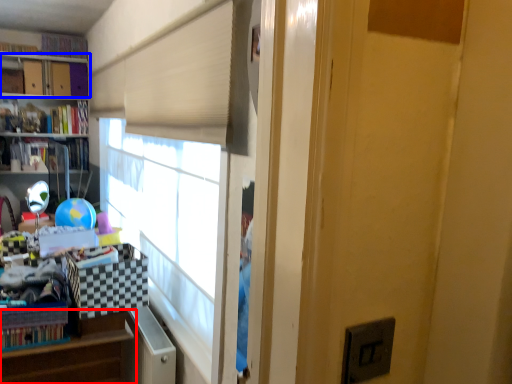
Question: Which of the following is the farthest to the observer, shelf (highlighted by a red box) or bookcase (highlighted by a blue box)?

Choices:
 (A) shelf
 (B) bookcase

Answer: (B)